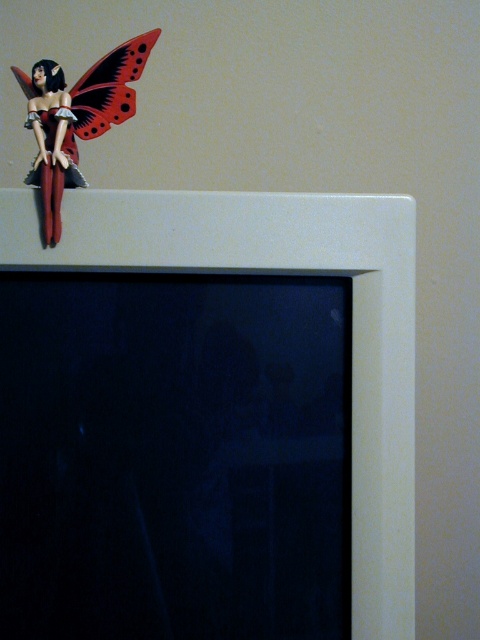
You are a collector of small decorative items. You have a shelf that can only accommodate items with a width of 10 cm or less. You see the matte black fairy at upper left and the matte plastic butterfly at upper left in the image. Based on their widths, which item would you choose to place on the shelf?

The matte black fairy at upper left has a lesser width compared to the matte plastic butterfly at upper left. Therefore, the matte black fairy at upper left is more likely to fit on the shelf since it is narrower.

You are a collector who wants to place a new miniature dragon figurine between the matte black fairy at upper left and the matte plastic butterfly at upper left on the computer monitor. The dragon is 1.5 inches long. Do you think there is enough space between them to fit the dragon?

The distance between the matte black fairy at upper left and the matte plastic butterfly at upper left is 1.46 inches. Since the dragon is 1.5 inches long, there isn not enough space to fit it between them.

You are organizing a display on a shelf and see the matte black fairy at upper left and the matte plastic butterfly at upper left. Which object is positioned lower on the shelf?

The matte black fairy at upper left is positioned lower than the matte plastic butterfly at upper left.